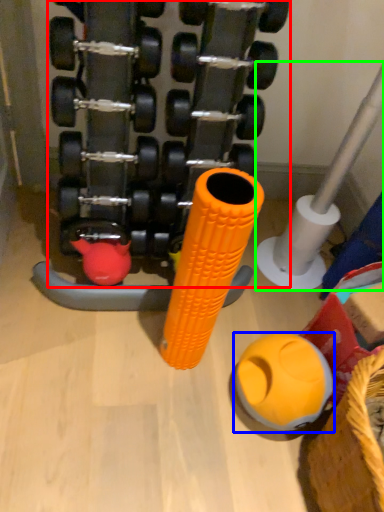
Question: Considering the real-world distances, which object is farthest from dumbbell (highlighted by a red box)? toy (highlighted by a blue box) or pipe (highlighted by a green box)?

Choices:
 (A) toy
 (B) pipe

Answer: (A)